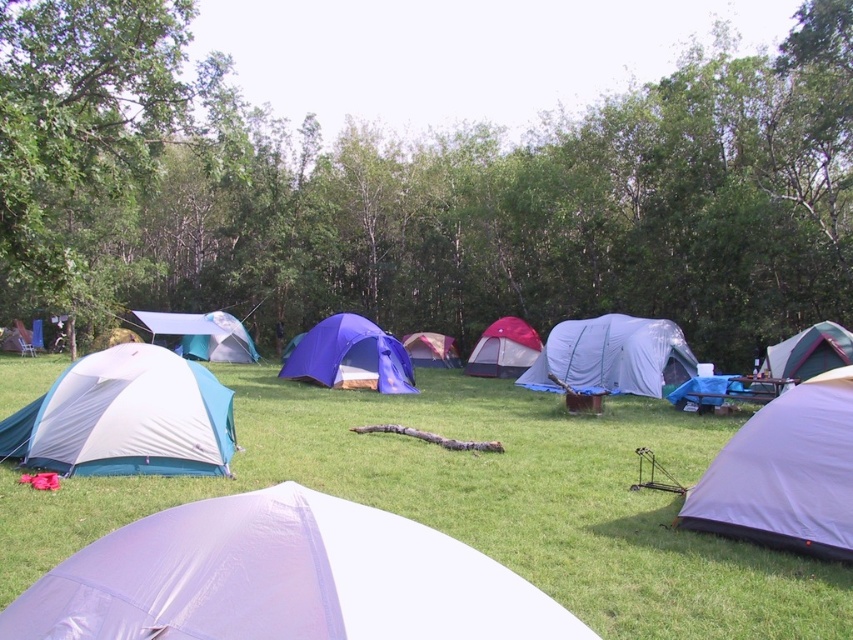
Question: Does gray fabric tent at center appear over green fabric tent at right?

Choices:
 (A) no
 (B) yes

Answer: (A)

Question: Which of the following is the farthest from the observer?

Choices:
 (A) (637, 385)
 (B) (410, 333)

Answer: (B)

Question: Is white glossy tent at lower center to the left of matte blue tent at center from the viewer's perspective?

Choices:
 (A) no
 (B) yes

Answer: (A)

Question: Which object is farther from the camera taking this photo?

Choices:
 (A) matte blue tent at center
 (B) matte purple tent at lower right
 (C) green fabric tent at right

Answer: (A)

Question: Which object appears farthest from the camera in this image?

Choices:
 (A) teal matte tent at lower left
 (B) teal fabric tent at center-left

Answer: (B)

Question: Is the position of white glossy tent at lower center more distant than that of matte pink tent at center?

Choices:
 (A) yes
 (B) no

Answer: (B)